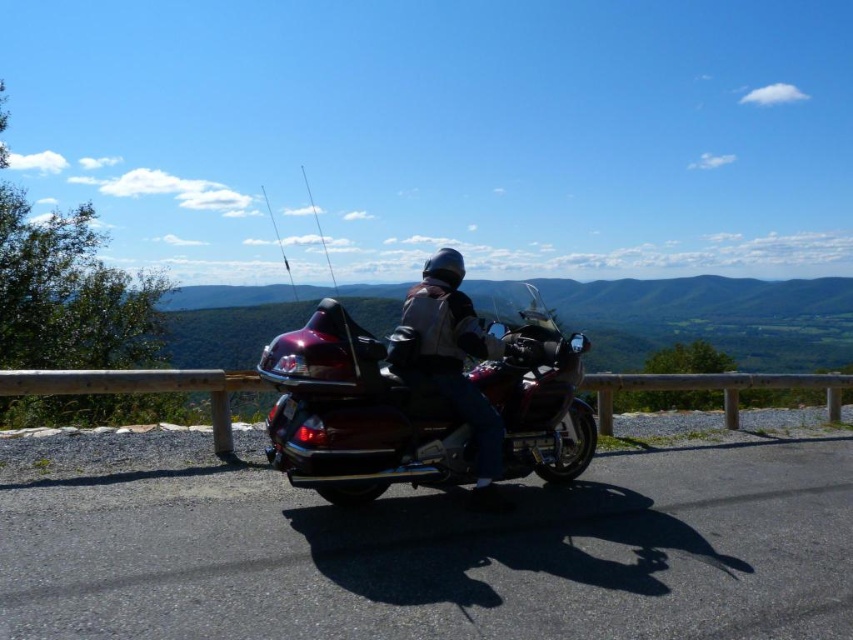
Between point (479, 481) and point (318, 228), which one is positioned behind?

The point (318, 228) is more distant.

The width and height of the screenshot is (853, 640). What are the coordinates of `matte black motorcycle at center` in the screenshot? It's located at click(x=456, y=360).

Between metallic burgundy motorcycle at center and metallic fishing pole at upper center, which one appears on the left side from the viewer's perspective?

Positioned to the left is metallic fishing pole at upper center.

Does point (550, 390) lie behind point (265, 202)?

That is False.

What do you see at coordinates (358, 412) in the screenshot? I see `metallic burgundy motorcycle at center` at bounding box center [358, 412].

Find the location of `metallic burgundy motorcycle at center`. metallic burgundy motorcycle at center is located at coordinates (358, 412).

Which is more to the right, wooden rail at lower center or metallic fishing pole at upper center?

wooden rail at lower center is more to the right.

Does wooden rail at lower center come behind metallic fishing pole at upper center?

No, it is not.

In order to click on wooden rail at lower center in this screenshot , I will do `click(141, 388)`.